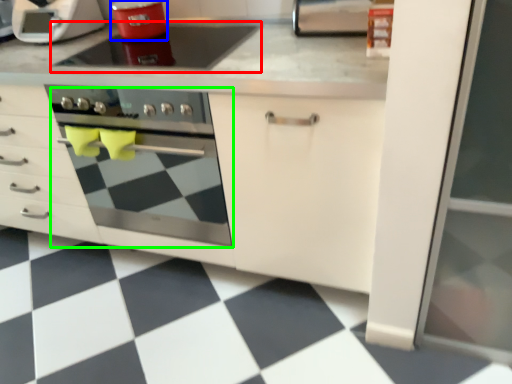
Question: Estimate the real-world distances between objects in this image. Which object is closer to gas stove (highlighted by a red box), kitchen appliance (highlighted by a blue box) or oven (highlighted by a green box)?

Choices:
 (A) kitchen appliance
 (B) oven

Answer: (A)